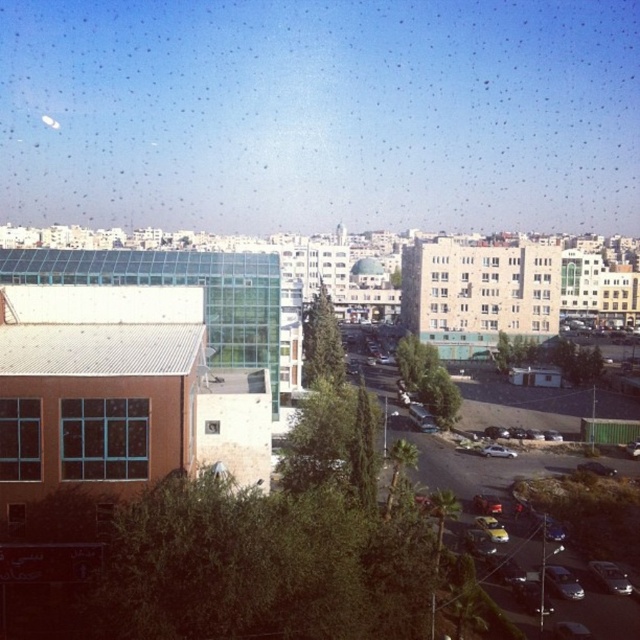
Image resolution: width=640 pixels, height=640 pixels. Describe the element at coordinates (563, 582) in the screenshot. I see `satin silver sedan at lower right` at that location.

The height and width of the screenshot is (640, 640). What do you see at coordinates (563, 582) in the screenshot? I see `satin silver sedan at lower right` at bounding box center [563, 582].

Identify the location of satin silver sedan at lower right. This screenshot has height=640, width=640. (563, 582).

Does shiny silver car at lower right have a lesser height compared to silver metallic car at lower right?

Yes, shiny silver car at lower right is shorter than silver metallic car at lower right.

Does shiny silver car at lower right appear on the right side of silver metallic car at lower right?

In fact, shiny silver car at lower right is to the left of silver metallic car at lower right.

Image resolution: width=640 pixels, height=640 pixels. What do you see at coordinates (611, 577) in the screenshot?
I see `shiny silver car at lower right` at bounding box center [611, 577].

Image resolution: width=640 pixels, height=640 pixels. In order to click on shiny silver car at lower right in this screenshot , I will do `click(611, 577)`.

Is point (12, 416) more distant than point (506, 449)?

No, (12, 416) is in front of (506, 449).

Is point (38, 472) closer to camera compared to point (490, 454)?

Yes, it is in front of point (490, 454).

This screenshot has width=640, height=640. I want to click on brown matte window at lower left, so click(19, 440).